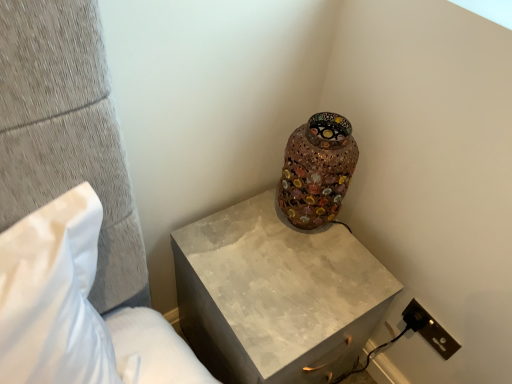
Question: Is mosaic glass vase at upper right positioned in front of brown plastic electrical outlet at lower right?

Choices:
 (A) no
 (B) yes

Answer: (B)

Question: Is mosaic glass vase at upper right taller than brown plastic electrical outlet at lower right?

Choices:
 (A) yes
 (B) no

Answer: (A)

Question: Is mosaic glass vase at upper right directly adjacent to brown plastic electrical outlet at lower right?

Choices:
 (A) yes
 (B) no

Answer: (B)

Question: From a real-world perspective, is mosaic glass vase at upper right located higher than brown plastic electrical outlet at lower right?

Choices:
 (A) yes
 (B) no

Answer: (A)

Question: Could you tell me if mosaic glass vase at upper right is turned towards brown plastic electrical outlet at lower right?

Choices:
 (A) no
 (B) yes

Answer: (A)

Question: Is mosaic glass vase at upper right smaller than brown plastic electrical outlet at lower right?

Choices:
 (A) no
 (B) yes

Answer: (A)

Question: From the image's perspective, would you say matte concrete nightstand at upper right is shown under brown plastic electrical outlet at lower right?

Choices:
 (A) yes
 (B) no

Answer: (B)

Question: Is matte concrete nightstand at upper right located outside brown plastic electrical outlet at lower right?

Choices:
 (A) no
 (B) yes

Answer: (B)

Question: Is matte concrete nightstand at upper right shorter than brown plastic electrical outlet at lower right?

Choices:
 (A) yes
 (B) no

Answer: (B)

Question: Can you confirm if matte concrete nightstand at upper right is positioned to the left of brown plastic electrical outlet at lower right?

Choices:
 (A) no
 (B) yes

Answer: (B)

Question: Is matte concrete nightstand at upper right thinner than brown plastic electrical outlet at lower right?

Choices:
 (A) no
 (B) yes

Answer: (A)

Question: Is matte concrete nightstand at upper right to the right of brown plastic electrical outlet at lower right from the viewer's perspective?

Choices:
 (A) yes
 (B) no

Answer: (B)

Question: Are brown plastic electrical outlet at lower right and mosaic glass vase at upper right making contact?

Choices:
 (A) no
 (B) yes

Answer: (A)